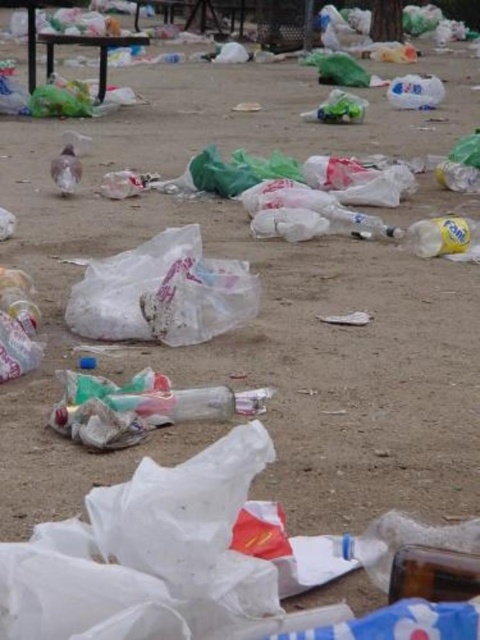
Question: Does transparent plastic bottle at lower right appear on the left side of white plastic bottle at center-right?

Choices:
 (A) yes
 (B) no

Answer: (A)

Question: Can you confirm if transparent plastic bottle at lower right is positioned above white plastic bottle at center-right?

Choices:
 (A) no
 (B) yes

Answer: (A)

Question: Which of the following is the farthest from the observer?

Choices:
 (A) transparent plastic bag at center
 (B) transparent plastic bottle at lower right
 (C) white plastic bottle at center-right

Answer: (C)

Question: Which object appears closest to the camera in this image?

Choices:
 (A) white plastic bottle at center-right
 (B) transparent plastic bottle at lower right
 (C) transparent plastic bag at center

Answer: (B)

Question: Based on their relative distances, which object is farther from the transparent plastic bottle at lower right?

Choices:
 (A) white plastic bottle at center-right
 (B) transparent plastic bag at center

Answer: (A)

Question: Is transparent plastic bag at center behind transparent plastic bottle at lower right?

Choices:
 (A) yes
 (B) no

Answer: (A)